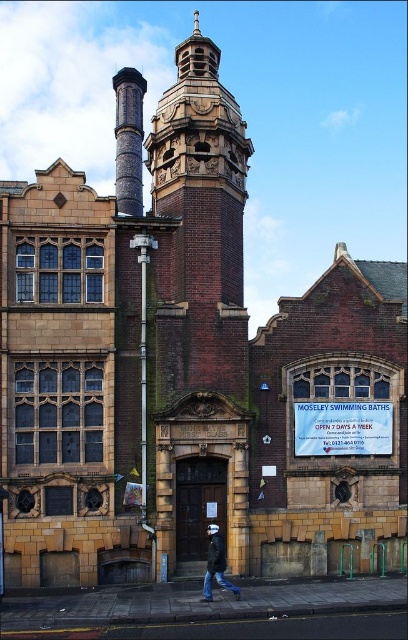
Who is positioned more to the left, rustic stone chimney at upper center or dark blue jeans at lower center?

Positioned to the left is rustic stone chimney at upper center.

Can you confirm if rustic stone chimney at upper center is positioned to the left of dark blue jeans at lower center?

Yes, rustic stone chimney at upper center is to the left of dark blue jeans at lower center.

Describe the element at coordinates (128, 140) in the screenshot. The height and width of the screenshot is (640, 408). I see `rustic stone chimney at upper center` at that location.

Locate an element on the screen. rustic stone chimney at upper center is located at coordinates (128, 140).